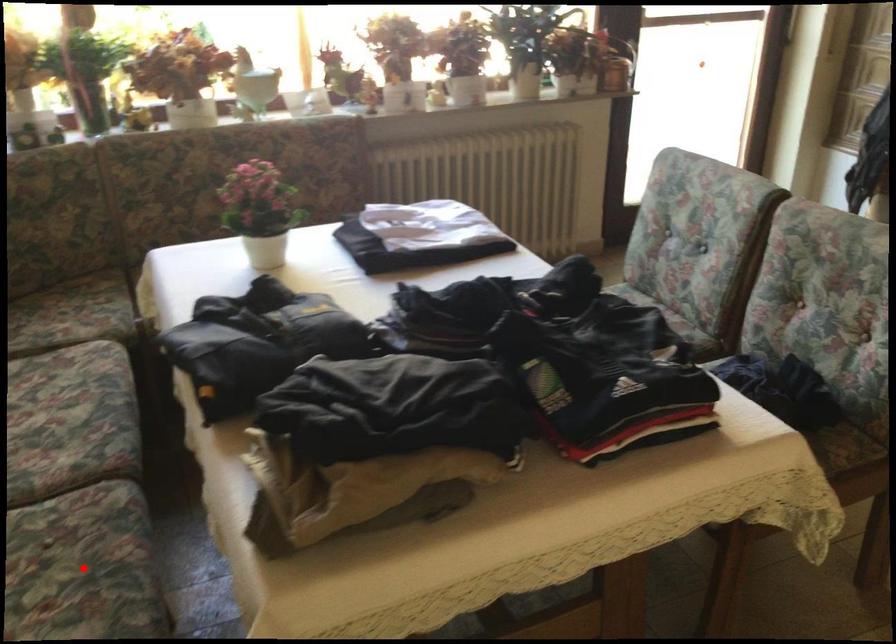
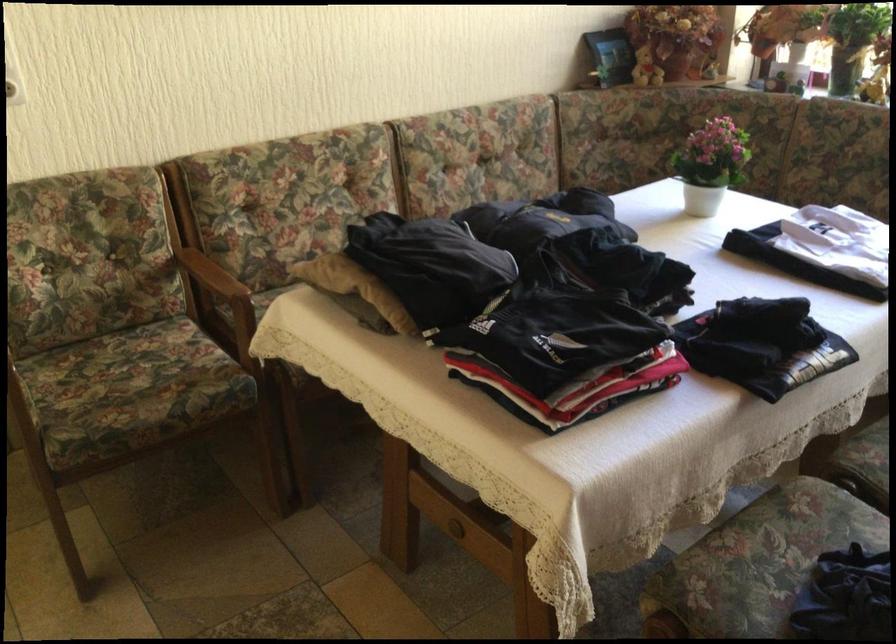
Question: I am providing you with two images of the same scene from different viewpoints. A red point is marked on the first image. At the location where the point appears in image 1, is it still visible in image 2?

Choices:
 (A) Yes
 (B) No

Answer: (B)